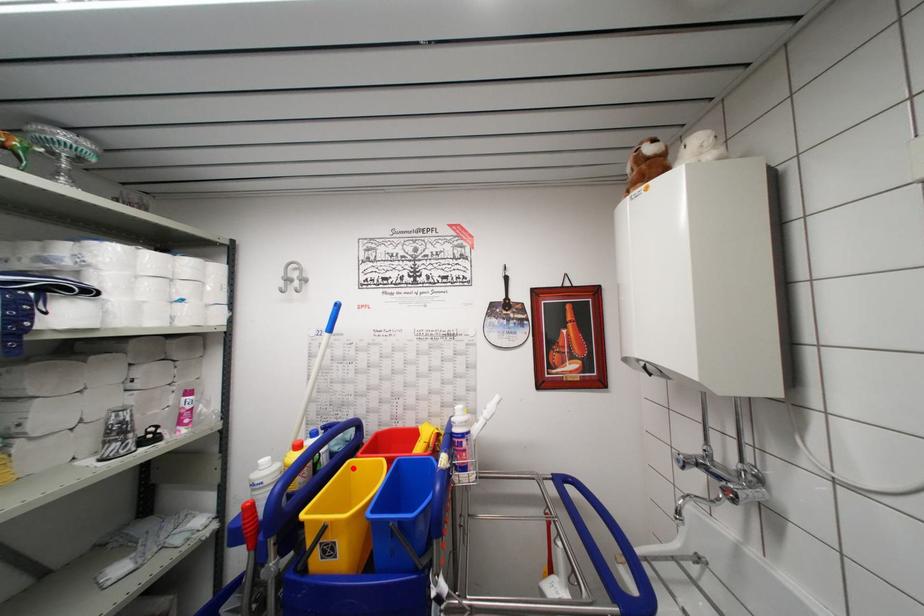
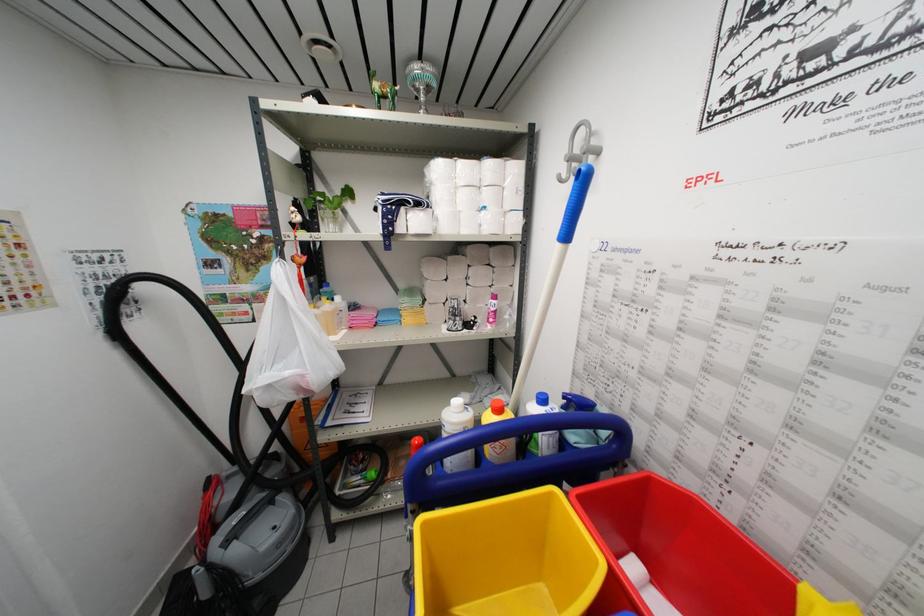
Where in the second image is the point corresponding to the highlighted location from the first image?

(554, 498)